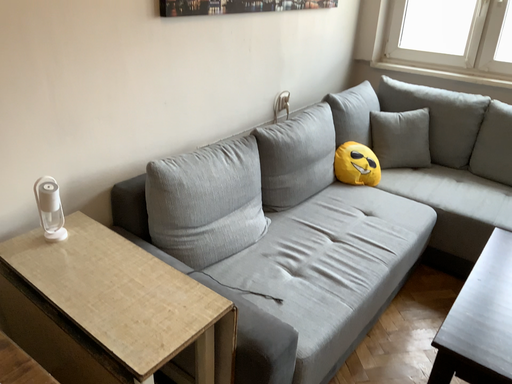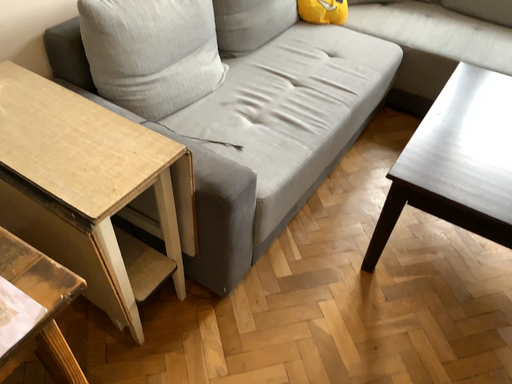
Question: How did the camera likely rotate when shooting the video?

Choices:
 (A) rotated downward
 (B) rotated upward

Answer: (A)